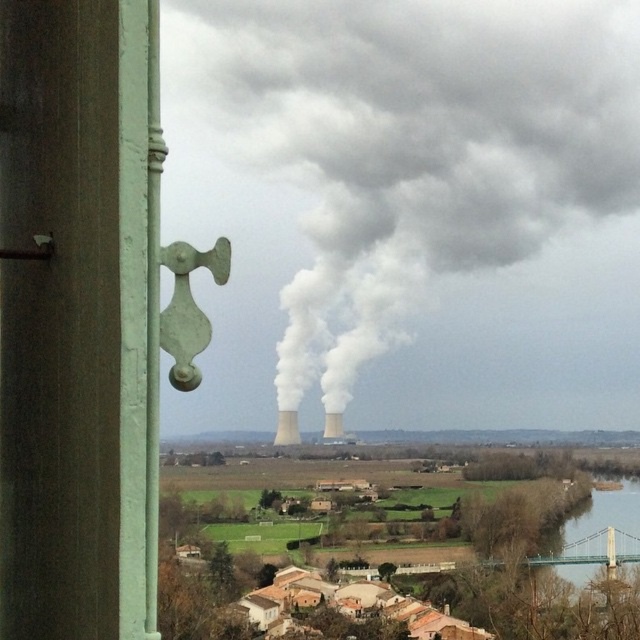
Question: Estimate the real-world distances between objects in this image. Which object is farther from the smooth concrete chimney at center?

Choices:
 (A) white smoke at center
 (B) white matte tower at center

Answer: (A)

Question: Does smooth concrete chimney at center have a larger size compared to white matte tower at center?

Choices:
 (A) no
 (B) yes

Answer: (B)

Question: Which of the following is the farthest from the observer?

Choices:
 (A) white matte tower at center
 (B) smooth concrete chimney at center

Answer: (B)

Question: Can you confirm if white smoke at center is bigger than white matte tower at center?

Choices:
 (A) yes
 (B) no

Answer: (A)

Question: Which of the following is the closest to the observer?

Choices:
 (A) smooth concrete chimney at center
 (B) white smoke at center

Answer: (B)

Question: Is white smoke at center further to camera compared to smooth concrete chimney at center?

Choices:
 (A) yes
 (B) no

Answer: (B)